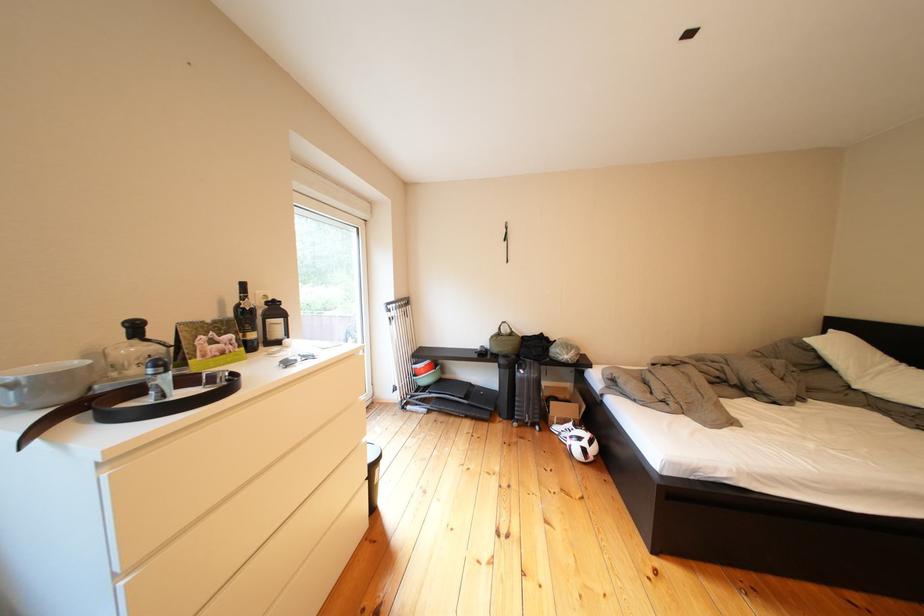
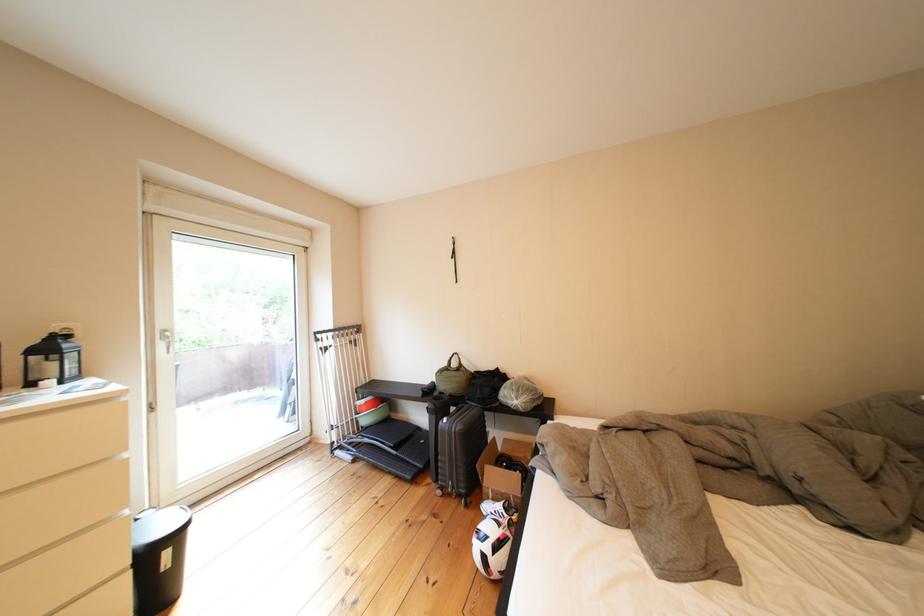
The point at (569,413) is marked in the first image. Where is the corresponding point in the second image?

(505, 480)